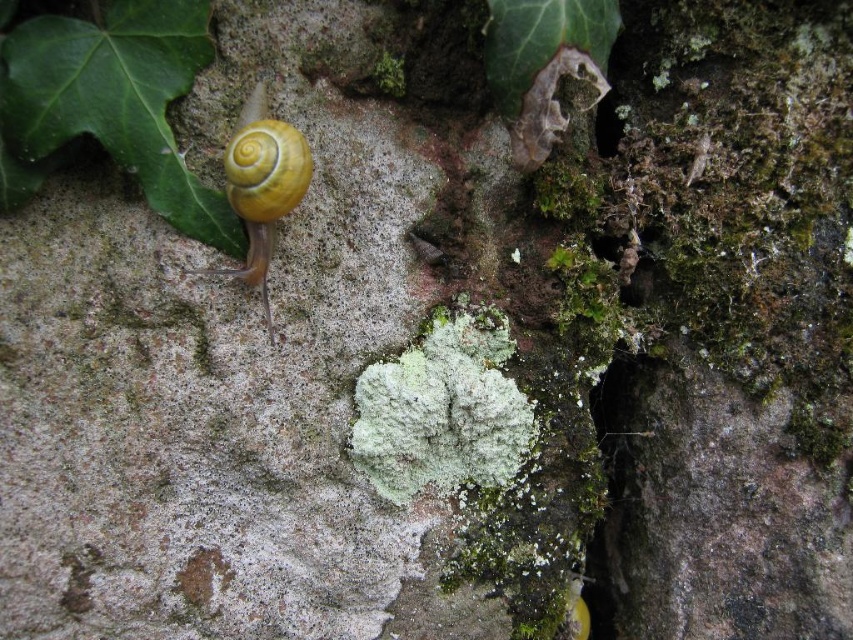
Who is shorter, green matte leaf at upper left or yellow shiny snail at upper left?

Standing shorter between the two is green matte leaf at upper left.

Between green matte leaf at upper left and yellow shiny snail at upper left, which one appears on the left side from the viewer's perspective?

Positioned to the left is green matte leaf at upper left.

Is point (148, 195) farther from camera compared to point (270, 228)?

No, it is not.

Where is `green matte leaf at upper left`? This screenshot has height=640, width=853. green matte leaf at upper left is located at coordinates (120, 99).